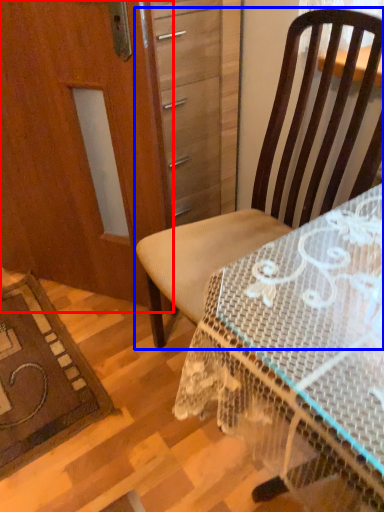
Question: Which object is further to the camera taking this photo, screen door (highlighted by a red box) or chair (highlighted by a blue box)?

Choices:
 (A) screen door
 (B) chair

Answer: (A)